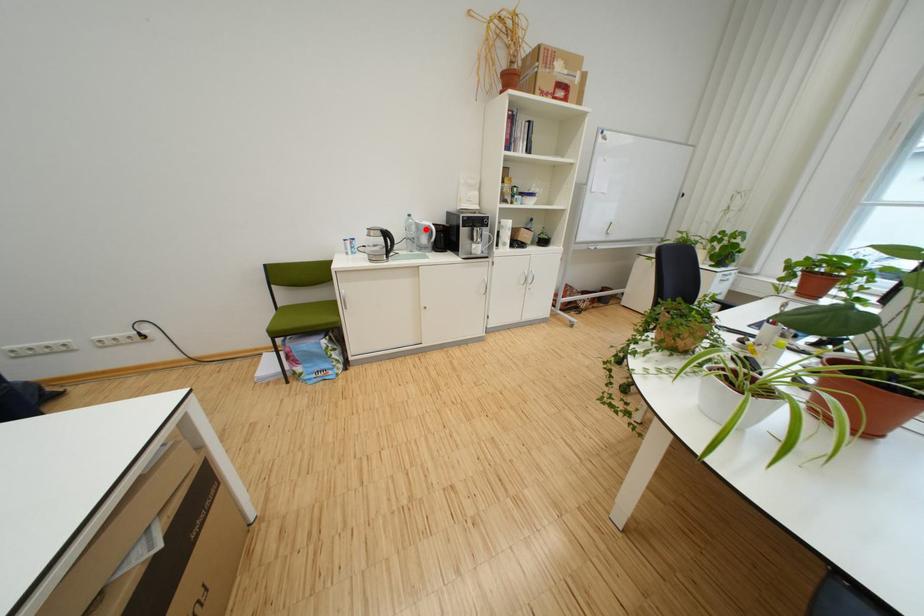
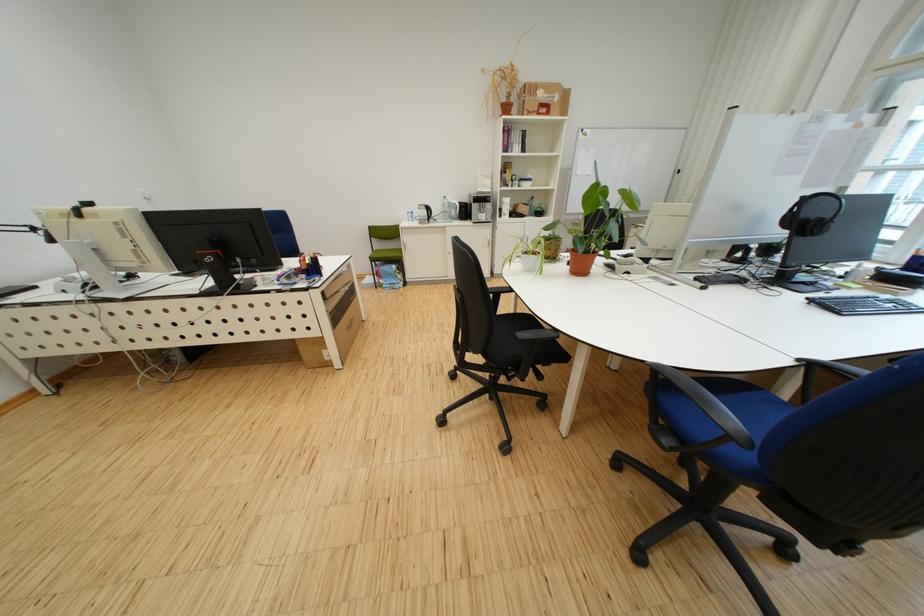
In the second image, find the point that corresponds to the highlighted location in the first image.

(458, 207)